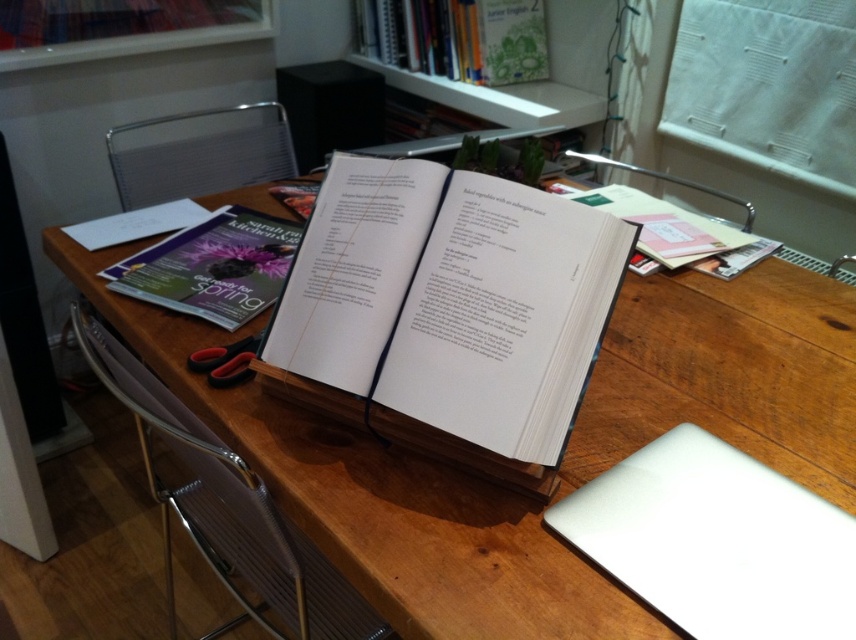
Question: Which object is the farthest from the metallic silver chair at upper center?

Choices:
 (A) purple matte magazine at left
 (B) hardcover book at upper center
 (C) wooden table at center
 (D) black rubber scissors at lower left

Answer: (D)

Question: Can you confirm if white paper at center is positioned above white paper book at center?

Choices:
 (A) yes
 (B) no

Answer: (B)

Question: Does metallic mesh chair at upper left have a greater width compared to white paper book at center?

Choices:
 (A) no
 (B) yes

Answer: (B)

Question: Which object is positioned closest to the metallic silver chair at upper center?

Choices:
 (A) white glossy bookshelf at upper center
 (B) purple matte magazine at left
 (C) metallic mesh chair at upper left

Answer: (A)

Question: Can you confirm if metallic silver chair at center is positioned above white paper book at center?

Choices:
 (A) no
 (B) yes

Answer: (A)

Question: Which of these objects is positioned closest to the black rubber scissors at lower left?

Choices:
 (A) white paper at center
 (B) white paper book at center
 (C) metallic mesh chair at upper left

Answer: (A)